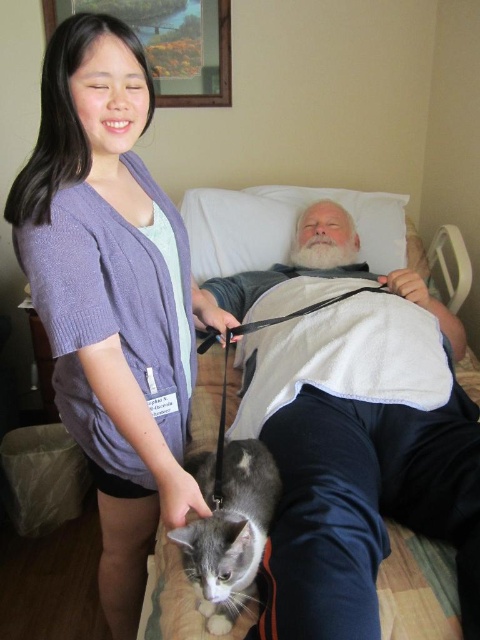
Consider the image. Is purple knitted cardigan at upper left to the left of gray fur cat at lower center from the viewer's perspective?

Indeed, purple knitted cardigan at upper left is positioned on the left side of gray fur cat at lower center.

Is point (186, 433) closer to viewer compared to point (255, 440)?

No, it is behind (255, 440).

What are the coordinates of `purple knitted cardigan at upper left` in the screenshot? It's located at tap(111, 294).

Can you confirm if gray fur cat at lower left is wider than gray fur cat at lower center?

Correct, the width of gray fur cat at lower left exceeds that of gray fur cat at lower center.

Is point (463, 392) closer to camera compared to point (252, 576)?

No, it is not.

Is point (237, 292) less distant than point (251, 548)?

No.

Find the location of a particular element. gray fur cat at lower left is located at coordinates (361, 456).

Between gray fur cat at lower left and purple knitted cardigan at upper left, which one has more height?

With more height is purple knitted cardigan at upper left.

Does gray fur cat at lower left appear under purple knitted cardigan at upper left?

No.

What do you see at coordinates (361, 456) in the screenshot? I see `gray fur cat at lower left` at bounding box center [361, 456].

I want to click on gray fur cat at lower left, so click(x=361, y=456).